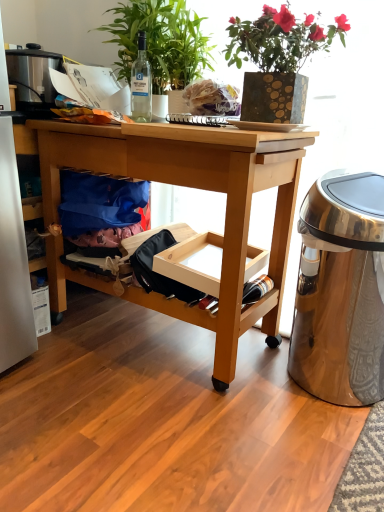
What do you see at coordinates (33, 76) in the screenshot?
I see `stainless steel microwave at upper left` at bounding box center [33, 76].

Describe the element at coordinates (98, 202) in the screenshot. The width and height of the screenshot is (384, 512). I see `blue fabric bag at lower left` at that location.

The height and width of the screenshot is (512, 384). Describe the element at coordinates (341, 290) in the screenshot. I see `polished metallic trash can at right` at that location.

Image resolution: width=384 pixels, height=512 pixels. Find the location of `gold textured vase at upper center, the 3th houseplant in the left-to-right sequence`. gold textured vase at upper center, the 3th houseplant in the left-to-right sequence is located at coordinates (278, 60).

Find the location of a particular element. This screenshot has width=384, height=512. green leafy plant at upper center, acting as the second houseplant starting from the left is located at coordinates (184, 51).

This screenshot has width=384, height=512. In order to click on green leafy plant at upper center, which appears as the first houseplant when viewed from the left in this screenshot , I will do `click(160, 41)`.

Considering the relative positions of white matte plate at center and green leafy plant at upper center, which appears as the first houseplant when viewed from the left, in the image provided, is white matte plate at center in front of green leafy plant at upper center, which appears as the first houseplant when viewed from the left,?

Yes, white matte plate at center is closer to the viewer.

Visually, is white matte plate at center positioned to the left or to the right of green leafy plant at upper center, which is the third houseplant in right-to-left order?

From the image, it's evident that white matte plate at center is to the right of green leafy plant at upper center, which is the third houseplant in right-to-left order.

Is point (304, 128) positioned in front of point (164, 15)?

No.

Based on the photo, can you confirm if stainless steel microwave at upper left is shorter than gold textured vase at upper center, the 3th houseplant in the left-to-right sequence?

Indeed, stainless steel microwave at upper left has a lesser height compared to gold textured vase at upper center, the 3th houseplant in the left-to-right sequence.

From the image's perspective, between stainless steel microwave at upper left and gold textured vase at upper center, which appears as the first houseplant when viewed from the right, who is located below?

gold textured vase at upper center, which appears as the first houseplant when viewed from the right, is shown below in the image.

Is stainless steel microwave at upper left touching gold textured vase at upper center, which appears as the first houseplant when viewed from the right?

There is a gap between stainless steel microwave at upper left and gold textured vase at upper center, which appears as the first houseplant when viewed from the right.

Is green leafy plant at upper center, which is the third houseplant in right-to-left order, smaller than polished metallic trash can at right?

Indeed, green leafy plant at upper center, which is the third houseplant in right-to-left order, has a smaller size compared to polished metallic trash can at right.

Is green leafy plant at upper center, which is the third houseplant in right-to-left order, positioned in front of polished metallic trash can at right?

That is False.

Is green leafy plant at upper center, which is the third houseplant in right-to-left order, next to polished metallic trash can at right?

No, green leafy plant at upper center, which is the third houseplant in right-to-left order, is not with polished metallic trash can at right.

Which of these two, green leafy plant at upper center, which appears as the first houseplant when viewed from the left, or polished metallic trash can at right, is wider?

green leafy plant at upper center, which appears as the first houseplant when viewed from the left.

In the scene shown: From a real-world perspective, which object stands above the other?

In real-world perspective, gold textured vase at upper center, the 3th houseplant in the left-to-right sequence, is above.

Considering the positions of objects gold textured vase at upper center, which appears as the first houseplant when viewed from the right, and stainless steel microwave at upper left in the image provided, who is more to the right, gold textured vase at upper center, which appears as the first houseplant when viewed from the right, or stainless steel microwave at upper left?

From the viewer's perspective, gold textured vase at upper center, which appears as the first houseplant when viewed from the right, appears more on the right side.

Who is smaller, gold textured vase at upper center, which appears as the first houseplant when viewed from the right, or stainless steel microwave at upper left?

stainless steel microwave at upper left is smaller.

Is gold textured vase at upper center, the 3th houseplant in the left-to-right sequence, not close to stainless steel microwave at upper left?

gold textured vase at upper center, the 3th houseplant in the left-to-right sequence, is actually quite close to stainless steel microwave at upper left.

Between point (219, 305) and point (35, 62), which one is positioned in front?

Point (219, 305)

Locate an element on the screen. appliance behind the light wood desk at center is located at coordinates (33, 76).

From a real-world perspective, who is located higher, light wood desk at center or stainless steel microwave at upper left?

stainless steel microwave at upper left, from a real-world perspective.

From the image's perspective, is light wood desk at center over stainless steel microwave at upper left?

No, from the image's perspective, light wood desk at center is not over stainless steel microwave at upper left.

From the image's perspective, would you say light wood desk at center is positioned over blue fabric bag at lower left?

Actually, light wood desk at center appears below blue fabric bag at lower left in the image.

Would you say light wood desk at center is a long distance from blue fabric bag at lower left?

Actually, light wood desk at center and blue fabric bag at lower left are a little close together.

Can you confirm if light wood desk at center is thinner than blue fabric bag at lower left?

In fact, light wood desk at center might be wider than blue fabric bag at lower left.

Is light wood desk at center to the left or to the right of blue fabric bag at lower left in the image?

From the image, it's evident that light wood desk at center is to the right of blue fabric bag at lower left.

Identify the location of bottle that is above the blue fabric bag at lower left (from a real-world perspective). (141, 83).

Is blue fabric bag at lower left facing towards clear glass bottle at upper center?

No, blue fabric bag at lower left is not oriented towards clear glass bottle at upper center.

Based on the photo, are blue fabric bag at lower left and clear glass bottle at upper center beside each other?

No.

Locate an element on the screen. the 1st houseplant behind the white matte plate at center, counting from the anchor's position is located at coordinates (160, 41).

Image resolution: width=384 pixels, height=512 pixels. In order to click on appliance above the gold textured vase at upper center, which appears as the first houseplant when viewed from the right (from the image's perspective) in this screenshot , I will do `click(33, 76)`.

From the picture: From the image, which object appears to be nearer to stainless steel microwave at upper left, polished metallic trash can at right or clear glass bottle at upper center?

Among the two, clear glass bottle at upper center is located nearer to stainless steel microwave at upper left.

From the image, which object appears to be nearer to clear glass bottle at upper center, stainless steel microwave at upper left or blue fabric bag at lower left?

stainless steel microwave at upper left is positioned closer to the anchor clear glass bottle at upper center.

Looking at this image, based on their spatial positions, is green leafy plant at upper center, which is the 2th houseplant from right to left, or clear glass bottle at upper center closer to gold textured vase at upper center, which appears as the first houseplant when viewed from the right?

The object closer to gold textured vase at upper center, which appears as the first houseplant when viewed from the right, is green leafy plant at upper center, which is the 2th houseplant from right to left.

In the scene shown: Estimate the real-world distances between objects in this image. Which object is further from stainless steel microwave at upper left, blue fabric bag at lower left or clear glass bottle at upper center?

Among the two, blue fabric bag at lower left is located further to stainless steel microwave at upper left.

Looking at the image, which one is located further to white matte plate at center, clear glass bottle at upper center or blue fabric bag at lower left?

Among the two, blue fabric bag at lower left is located further to white matte plate at center.

Estimate the real-world distances between objects in this image. Which object is closer to stainless steel microwave at upper left, green leafy plant at upper center, which is the 2th houseplant from right to left, or green leafy plant at upper center, which appears as the first houseplant when viewed from the left?

green leafy plant at upper center, which appears as the first houseplant when viewed from the left, is closer to stainless steel microwave at upper left.

Based on their spatial positions, is white matte plate at center or blue fabric bag at lower left closer to light wood desk at center?

blue fabric bag at lower left.

From the image, which object appears to be nearer to white matte plate at center, green leafy plant at upper center, acting as the second houseplant starting from the left, or green leafy plant at upper center, which is the third houseplant in right-to-left order?

The object closer to white matte plate at center is green leafy plant at upper center, acting as the second houseplant starting from the left.

Locate an element on the screen. houseplant between clear glass bottle at upper center and green leafy plant at upper center, which is the 2th houseplant from right to left, in the horizontal direction is located at coordinates (160, 41).

The image size is (384, 512). I want to click on houseplant located between green leafy plant at upper center, which appears as the first houseplant when viewed from the left, and gold textured vase at upper center, the 3th houseplant in the left-to-right sequence, in the left-right direction, so click(x=184, y=51).

You are a GUI agent. You are given a task and a screenshot of the screen. Output one action in this format:
    pyautogui.click(x=<x>, y=<y>)
    Task: Click on the desk situated between stainless steel microwave at upper left and polished metallic trash can at right from left to right
    This screenshot has height=512, width=384.
    Given the screenshot: What is the action you would take?
    pyautogui.click(x=197, y=188)

Where is `bottle situated between blue fabric bag at lower left and gold textured vase at upper center, the 3th houseplant in the left-to-right sequence, from left to right`? bottle situated between blue fabric bag at lower left and gold textured vase at upper center, the 3th houseplant in the left-to-right sequence, from left to right is located at coordinates (141, 83).